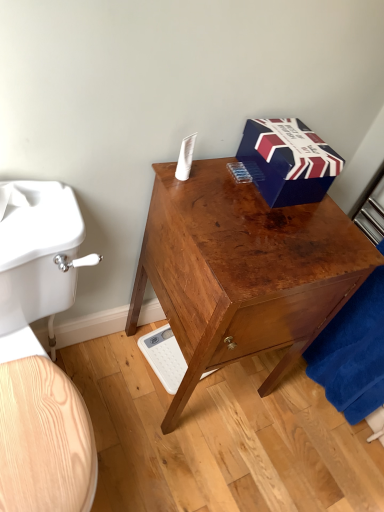
The width and height of the screenshot is (384, 512). Find the location of `white matte toilet paper at upper center`. white matte toilet paper at upper center is located at coordinates (185, 158).

What do you see at coordinates (243, 271) in the screenshot?
I see `shiny brown wooden desk at center` at bounding box center [243, 271].

The height and width of the screenshot is (512, 384). What do you see at coordinates (164, 357) in the screenshot?
I see `white plastic scale at lower center` at bounding box center [164, 357].

Find the location of a particular element. The height and width of the screenshot is (512, 384). light wood toilet at left is located at coordinates (40, 354).

Based on the photo, which point is more forward, (354, 294) or (26, 503)?

The point (26, 503) is more forward.

In terms of size, does velvety blue towel at lower right appear bigger or smaller than light wood toilet at left?

In the image, velvety blue towel at lower right appears to be smaller than light wood toilet at left.

From the image's perspective, is velvety blue towel at lower right located beneath light wood toilet at left?

Incorrect, from the image's perspective, velvety blue towel at lower right is higher than light wood toilet at left.

Which object is positioned more to the right, velvety blue towel at lower right or light wood toilet at left?

From the viewer's perspective, velvety blue towel at lower right appears more on the right side.

From the image's perspective, which one is positioned higher, white matte toilet paper at upper center or white plastic scale at lower center?

white matte toilet paper at upper center is shown above in the image.

Considering the sizes of white matte toilet paper at upper center and white plastic scale at lower center in the image, is white matte toilet paper at upper center wider or thinner than white plastic scale at lower center?

In the image, white matte toilet paper at upper center appears to be more narrow than white plastic scale at lower center.

Is white matte toilet paper at upper center bigger than white plastic scale at lower center?

Actually, white matte toilet paper at upper center might be smaller than white plastic scale at lower center.

Is light wood toilet at left facing away from white matte toilet paper at upper center?

No, white matte toilet paper at upper center is not at the back of light wood toilet at left.

From the picture: Can you confirm if light wood toilet at left is taller than white matte toilet paper at upper center?

Yes.

Is point (10, 424) more distant than point (193, 144)?

No, (10, 424) is closer to viewer.

Identify the location of toilet below the white matte toilet paper at upper center (from the image's perspective). The image size is (384, 512). (40, 354).

From the picture: Considering the relative positions of white plastic scale at lower center and blue cardboard box at upper right in the image provided, is white plastic scale at lower center behind blue cardboard box at upper right?

Yes, white plastic scale at lower center is behind blue cardboard box at upper right.

Is white plastic scale at lower center beside blue cardboard box at upper right?

There is a gap between white plastic scale at lower center and blue cardboard box at upper right.

Is white plastic scale at lower center smaller than blue cardboard box at upper right?

Indeed, white plastic scale at lower center has a smaller size compared to blue cardboard box at upper right.

Based on the photo, considering the relative sizes of shiny brown wooden desk at center and white plastic scale at lower center in the image provided, is shiny brown wooden desk at center wider than white plastic scale at lower center?

Yes.

Based on the photo, is shiny brown wooden desk at center bigger or smaller than white plastic scale at lower center?

shiny brown wooden desk at center is bigger than white plastic scale at lower center.

Is shiny brown wooden desk at center not near white plastic scale at lower center?

shiny brown wooden desk at center is near white plastic scale at lower center, not far away.

Measure the distance from shiny brown wooden desk at center to white plastic scale at lower center.

18.06 inches.

Considering the sizes of objects blue cardboard box at upper right and light wood toilet at left in the image provided, who is thinner, blue cardboard box at upper right or light wood toilet at left?

blue cardboard box at upper right.

Is blue cardboard box at upper right at the left side of light wood toilet at left?

No.

In the scene shown: From a real-world perspective, which is physically above, blue cardboard box at upper right or light wood toilet at left?

In real-world perspective, blue cardboard box at upper right is above.

Considering the relative sizes of blue cardboard box at upper right and white matte toilet paper at upper center in the image provided, is blue cardboard box at upper right wider than white matte toilet paper at upper center?

Correct, the width of blue cardboard box at upper right exceeds that of white matte toilet paper at upper center.

Considering the positions of objects blue cardboard box at upper right and white matte toilet paper at upper center in the image provided, who is behind, blue cardboard box at upper right or white matte toilet paper at upper center?

white matte toilet paper at upper center is behind.

Is blue cardboard box at upper right facing away from white matte toilet paper at upper center?

No, blue cardboard box at upper right's orientation is not away from white matte toilet paper at upper center.

In order to click on towel/napkin on the right of the light wood toilet at left in this screenshot , I will do `click(353, 352)`.

You are a GUI agent. You are given a task and a screenshot of the screen. Output one action in this format:
    pyautogui.click(x=<x>, y=<y>)
    Task: Click on the scale directly beneath the white matte toilet paper at upper center (from a real-world perspective)
    
    Given the screenshot: What is the action you would take?
    pos(164,357)

Based on their spatial positions, is velvety blue towel at lower right or white plastic scale at lower center further from white matte toilet paper at upper center?

Among the two, velvety blue towel at lower right is located further to white matte toilet paper at upper center.

Which object lies further to the anchor point light wood toilet at left, white plastic scale at lower center or shiny brown wooden desk at center?

white plastic scale at lower center is further to light wood toilet at left.

Based on the photo, which object lies nearer to the anchor point blue cardboard box at upper right, white matte toilet paper at upper center or velvety blue towel at lower right?

The object closer to blue cardboard box at upper right is white matte toilet paper at upper center.

Estimate the real-world distances between objects in this image. Which object is further from blue cardboard box at upper right, white matte toilet paper at upper center or white plastic scale at lower center?

The object further to blue cardboard box at upper right is white plastic scale at lower center.

Which object lies nearer to the anchor point light wood toilet at left, blue cardboard box at upper right or white plastic scale at lower center?

Among the two, blue cardboard box at upper right is located nearer to light wood toilet at left.

When comparing their distances from white plastic scale at lower center, does blue cardboard box at upper right or shiny brown wooden desk at center seem further?

blue cardboard box at upper right.

Estimate the real-world distances between objects in this image. Which object is further from white matte toilet paper at upper center, light wood toilet at left or velvety blue towel at lower right?

Among the two, velvety blue towel at lower right is located further to white matte toilet paper at upper center.

Which object lies nearer to the anchor point blue cardboard box at upper right, velvety blue towel at lower right or shiny brown wooden desk at center?

shiny brown wooden desk at center is closer to blue cardboard box at upper right.

I want to click on box positioned between shiny brown wooden desk at center and white plastic scale at lower center from near to far, so click(x=288, y=161).

Identify the location of toilet paper between blue cardboard box at upper right and white plastic scale at lower center from top to bottom. Image resolution: width=384 pixels, height=512 pixels. (185, 158).

Where is `toilet paper between light wood toilet at left and velvety blue towel at lower right from left to right`? The image size is (384, 512). toilet paper between light wood toilet at left and velvety blue towel at lower right from left to right is located at coordinates (185, 158).

This screenshot has height=512, width=384. In order to click on box between light wood toilet at left and velvety blue towel at lower right in the horizontal direction in this screenshot , I will do `click(288, 161)`.